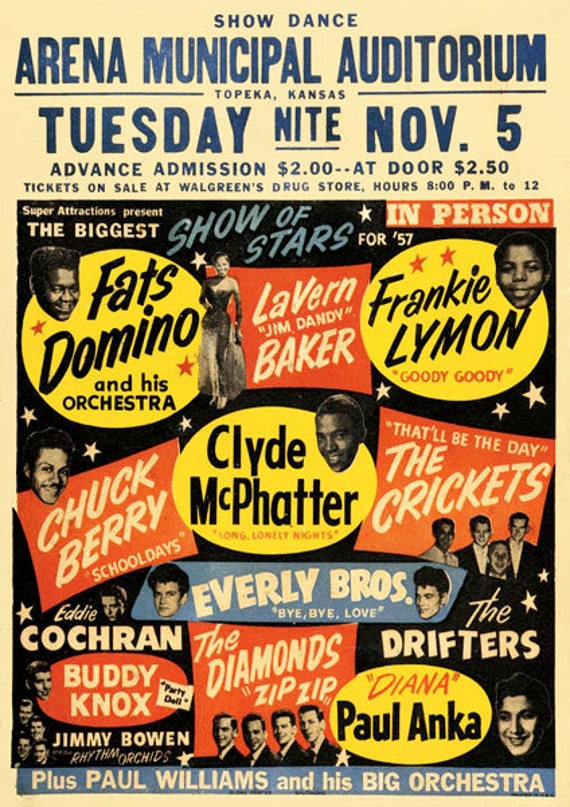
Find the location of a particular element. The width and height of the screenshot is (570, 807). old poster is located at coordinates (251, 307).